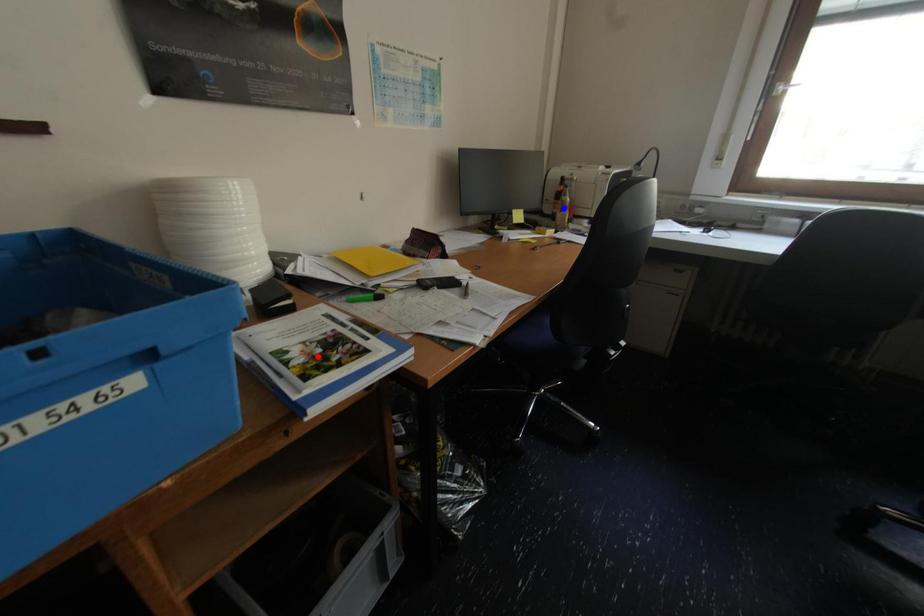
Question: Which of the two points in the image is closer to the camera?

Choices:
 (A) Blue point is closer.
 (B) Red point is closer.

Answer: (B)